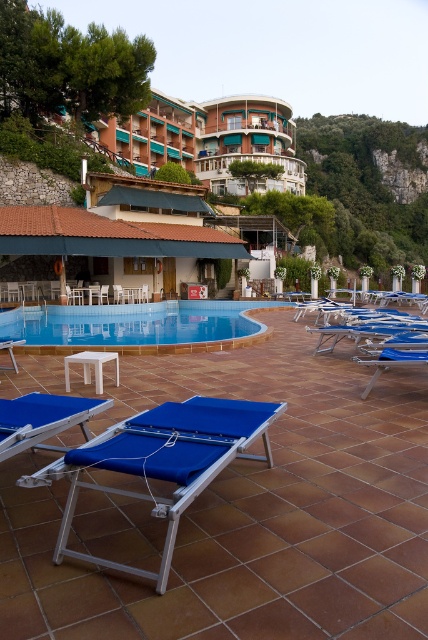
Can you confirm if blue fabric/daybed at lower left is positioned below green leafy hillside at upper right?

Indeed, blue fabric/daybed at lower left is positioned under green leafy hillside at upper right.

Is blue fabric/daybed at lower left above green leafy hillside at upper right?

Actually, blue fabric/daybed at lower left is below green leafy hillside at upper right.

Is point (181, 458) positioned after point (401, 160)?

No, it is in front of (401, 160).

Image resolution: width=428 pixels, height=640 pixels. Find the location of `blue fabric/daybed at lower left`. blue fabric/daybed at lower left is located at coordinates (163, 460).

Between blue fabric beach chair at right and blue fabric beach chair at lower left, which one has less height?

blue fabric beach chair at lower left

How much distance is there between blue fabric beach chair at right and blue fabric beach chair at lower left?

The distance of blue fabric beach chair at right from blue fabric beach chair at lower left is 17.60 feet.

This screenshot has width=428, height=640. Find the location of `blue fabric beach chair at right`. blue fabric beach chair at right is located at coordinates (372, 333).

At what (x,y) coordinates should I click in order to perform the action: click on blue fabric beach chair at right. Please return your answer as a coordinate pair (x, y). The height and width of the screenshot is (640, 428). Looking at the image, I should click on (372, 333).

Looking at this image, can you confirm if blue glossy pool at center is shorter than blue fabric beach chair at lower left?

Incorrect, blue glossy pool at center's height does not fall short of blue fabric beach chair at lower left's.

Does blue glossy pool at center lie behind blue fabric beach chair at lower left?

Yes, blue glossy pool at center is further from the viewer.

Which is in front, point (44, 344) or point (76, 397)?

Positioned in front is point (76, 397).

Identify the location of blue glossy pool at center. (133, 324).